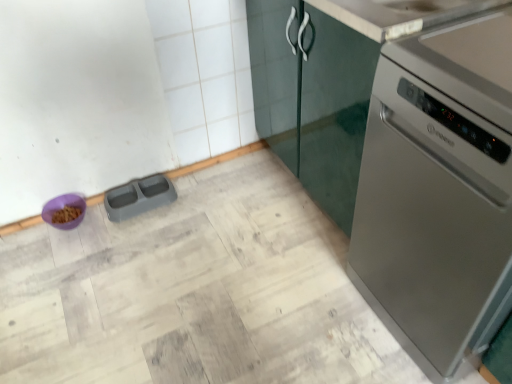
Question: Is satin silver dishwasher at right wider than gray plastic pet feeder at lower left, the 2th appliance in the left-to-right sequence?

Choices:
 (A) yes
 (B) no

Answer: (A)

Question: Is satin silver dishwasher at right touching gray plastic pet feeder at lower left, which is the 1th appliance from right to left?

Choices:
 (A) yes
 (B) no

Answer: (B)

Question: From a real-world perspective, is satin silver dishwasher at right below gray plastic pet feeder at lower left, which is the 1th appliance from right to left?

Choices:
 (A) no
 (B) yes

Answer: (A)

Question: Is satin silver dishwasher at right far away from gray plastic pet feeder at lower left, the 2th appliance in the left-to-right sequence?

Choices:
 (A) yes
 (B) no

Answer: (A)

Question: Considering the relative sizes of satin silver dishwasher at right and gray plastic pet feeder at lower left, which is the 1th appliance from right to left, in the image provided, is satin silver dishwasher at right taller than gray plastic pet feeder at lower left, which is the 1th appliance from right to left,?

Choices:
 (A) no
 (B) yes

Answer: (B)

Question: From a real-world perspective, is satin silver dishwasher at right on top of gray plastic pet feeder at lower left, which is the 1th appliance from right to left?

Choices:
 (A) yes
 (B) no

Answer: (A)

Question: From the image's perspective, does purple plastic bowl at lower left, the 2th appliance viewed from the right, appear higher than satin silver dishwasher at right?

Choices:
 (A) yes
 (B) no

Answer: (B)

Question: Considering the relative sizes of purple plastic bowl at lower left, arranged as the 1th appliance when viewed from the left, and satin silver dishwasher at right in the image provided, is purple plastic bowl at lower left, arranged as the 1th appliance when viewed from the left, taller than satin silver dishwasher at right?

Choices:
 (A) no
 (B) yes

Answer: (A)

Question: Considering the relative sizes of purple plastic bowl at lower left, arranged as the 1th appliance when viewed from the left, and satin silver dishwasher at right in the image provided, is purple plastic bowl at lower left, arranged as the 1th appliance when viewed from the left, wider than satin silver dishwasher at right?

Choices:
 (A) yes
 (B) no

Answer: (B)

Question: Is purple plastic bowl at lower left, arranged as the 1th appliance when viewed from the left, positioned with its back to satin silver dishwasher at right?

Choices:
 (A) no
 (B) yes

Answer: (A)

Question: Is purple plastic bowl at lower left, the 2th appliance viewed from the right, placed right next to satin silver dishwasher at right?

Choices:
 (A) no
 (B) yes

Answer: (A)

Question: Is purple plastic bowl at lower left, the 2th appliance viewed from the right, to the right of satin silver dishwasher at right from the viewer's perspective?

Choices:
 (A) no
 (B) yes

Answer: (A)

Question: Does satin silver dishwasher at right appear on the left side of purple plastic bowl at lower left, arranged as the 1th appliance when viewed from the left?

Choices:
 (A) yes
 (B) no

Answer: (B)